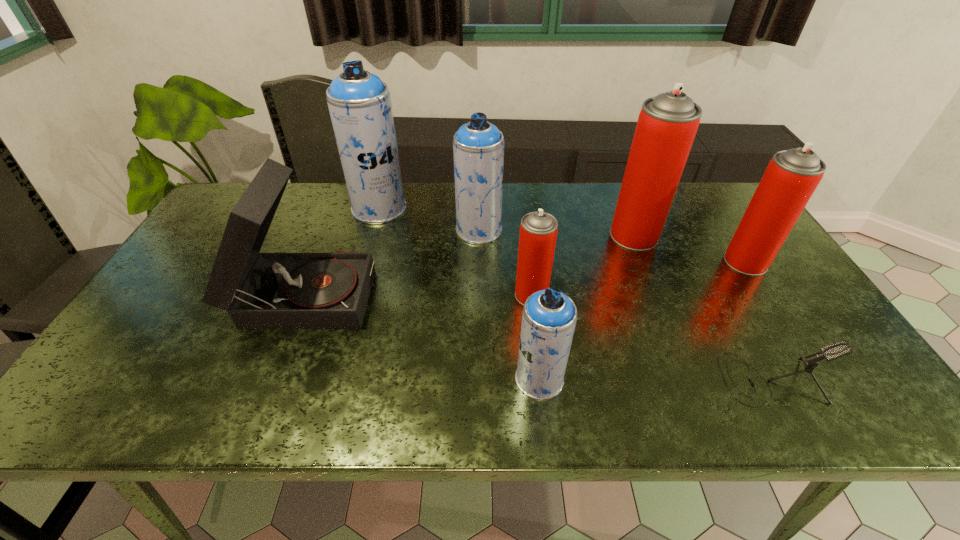
The width and height of the screenshot is (960, 540). In order to click on vacant point at the near edge in this screenshot , I will do `click(601, 403)`.

This screenshot has width=960, height=540. I want to click on vacant region at the left edge of the desktop, so click(180, 344).

This screenshot has height=540, width=960. In order to click on free point at the far right corner in this screenshot , I will do `click(706, 205)`.

Identify the location of unoccupied position between the rightmost red aerosol can and the microphone. The height and width of the screenshot is (540, 960). point(758,320).

Find the location of `unoccupied position between the second red aerosol can from right to left and the smallest red aerosol can`. unoccupied position between the second red aerosol can from right to left and the smallest red aerosol can is located at coordinates (583, 266).

The height and width of the screenshot is (540, 960). In order to click on free spot between the leftmost red aerosol can and the rightmost red aerosol can in this screenshot , I will do `click(638, 279)`.

At what (x,y) coordinates should I click in order to perform the action: click on free space between the nearest red aerosol can and the rightmost aerosol can. Please return your answer as a coordinate pair (x, y). Looking at the image, I should click on (638, 279).

You are a GUI agent. You are given a task and a screenshot of the screen. Output one action in this format:
    pyautogui.click(x=<x>, y=<y>)
    Task: Click on the free space between the rightmost red aerosol can and the shortest object
    This screenshot has width=960, height=540.
    Given the screenshot: What is the action you would take?
    pyautogui.click(x=758, y=320)

Identify the location of free space between the second aerosol can from right to left and the nearest blue aerosol can. Image resolution: width=960 pixels, height=540 pixels. (587, 307).

You are a GUI agent. You are given a task and a screenshot of the screen. Output one action in this format:
    pyautogui.click(x=<x>, y=<y>)
    Task: Click on the vacant area that lies between the phonograph_record and the second red aerosol can from left to right
    
    Given the screenshot: What is the action you would take?
    pyautogui.click(x=469, y=263)